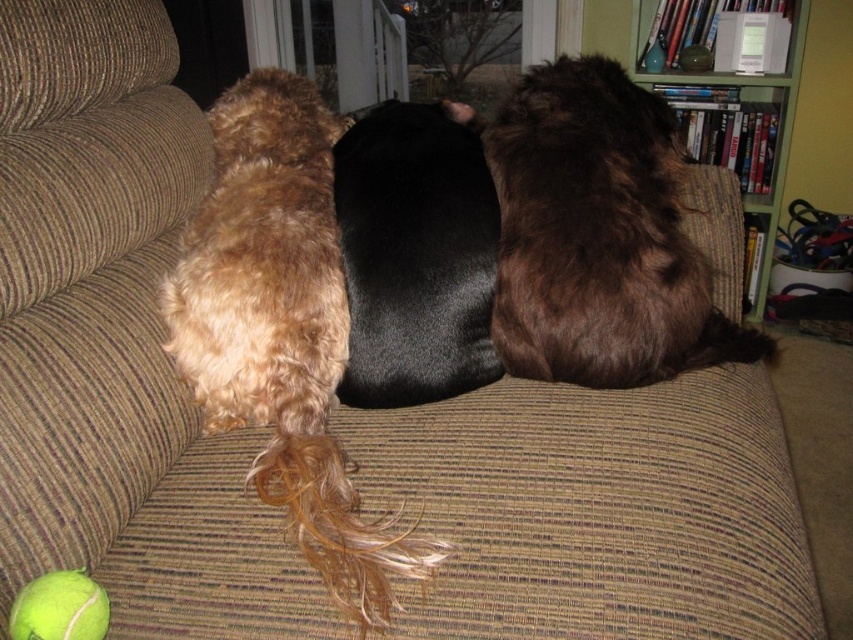
Question: Observing the image, what is the correct spatial positioning of shaggy golden fur at center in reference to brown fluffy dog at center?

Choices:
 (A) left
 (B) right

Answer: (A)

Question: Does brown fluffy dog at center lie in front of green rubber tennis ball at lower left?

Choices:
 (A) yes
 (B) no

Answer: (B)

Question: Which of these objects is positioned farthest from the brown fluffy dog at center?

Choices:
 (A) shaggy golden fur at center
 (B) green rubber tennis ball at lower left
 (C) green wood bookshelf at upper right

Answer: (C)

Question: Which of the following is the closest to the observer?

Choices:
 (A) shaggy golden fur at center
 (B) green rubber tennis ball at lower left
 (C) black smooth fur at center
 (D) green wood bookshelf at upper right

Answer: (B)

Question: Which point is farther from the camera taking this photo?

Choices:
 (A) (746, 205)
 (B) (372, 157)
 (C) (619, 96)
 (D) (299, 220)

Answer: (A)

Question: Is green wood bookshelf at upper right above green rubber tennis ball at lower left?

Choices:
 (A) yes
 (B) no

Answer: (A)